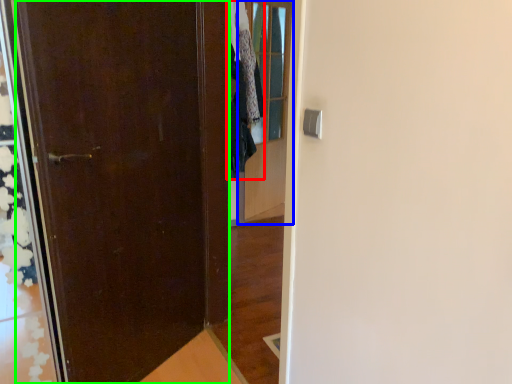
Question: Which is nearer to the clothing (highlighted by a red box)? glass door (highlighted by a blue box) or door (highlighted by a green box).

Choices:
 (A) glass door
 (B) door

Answer: (A)